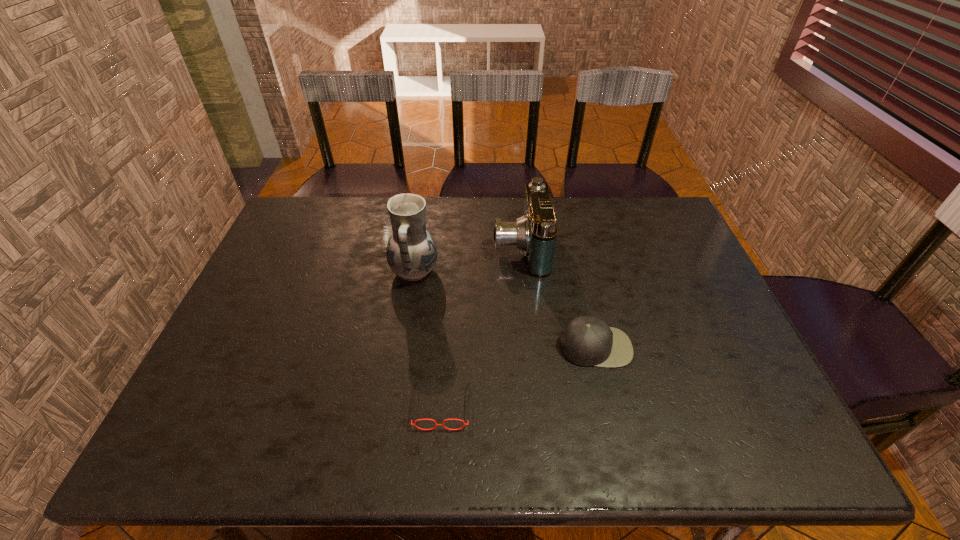
Identify the location of pitcher. Image resolution: width=960 pixels, height=540 pixels. (411, 252).

This screenshot has height=540, width=960. In order to click on camcorder in this screenshot , I will do `click(535, 233)`.

The image size is (960, 540). I want to click on the third tallest object, so click(x=586, y=340).

At what (x,y) coordinates should I click in order to perform the action: click on the second nearest object. Please return your answer as a coordinate pair (x, y). Looking at the image, I should click on (586, 340).

Locate an element on the screen. the shortest object is located at coordinates (436, 424).

Identify the location of the nearest object. The image size is (960, 540). (x=436, y=424).

Locate an element on the screen. The height and width of the screenshot is (540, 960). vacant space located on the front-facing side of the tallest object is located at coordinates (561, 272).

Find the location of a particular element. free spot located 0.360m on the front-facing side of the third shortest object is located at coordinates (378, 246).

Image resolution: width=960 pixels, height=540 pixels. What are the coordinates of `free region located on the front-facing side of the third shortest object` in the screenshot? It's located at (473, 246).

You are a GUI agent. You are given a task and a screenshot of the screen. Output one action in this format:
    pyautogui.click(x=<x>, y=<y>)
    Task: Click on the vacant space located on the front-facing side of the third shortest object
    
    Given the screenshot: What is the action you would take?
    pyautogui.click(x=467, y=246)